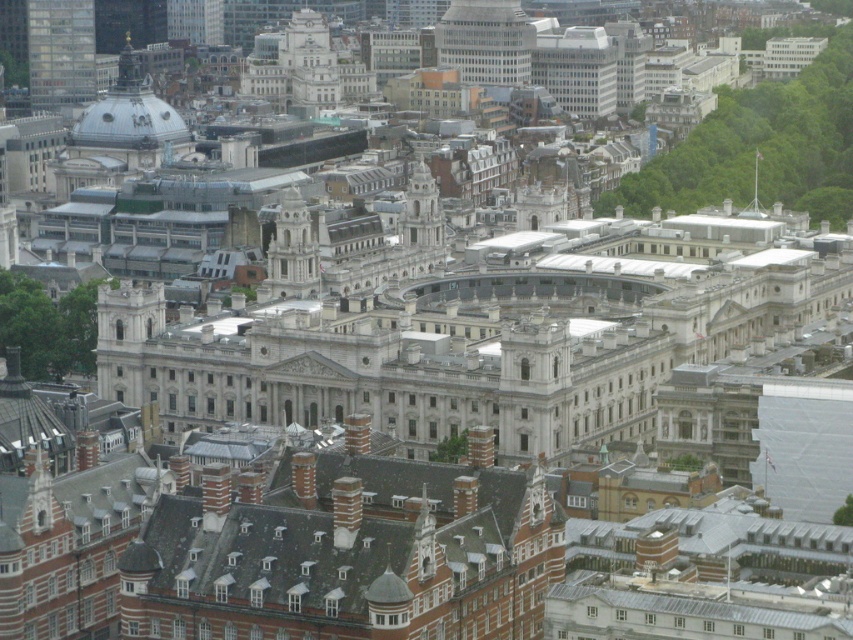
You are a city planner reviewing this aerial image. You need to determine the spatial relationship between the white glass tower at center and the white stone tower at center. Which one is located to the right of the other?

The white glass tower at center is positioned on the right side of the white stone tower at center.

You are a drone operator trying to deliver a package to the white glass tower at center. Your GPS shows a coordinate point at (485, 42). Is this the correct location for the white glass tower at center?

Yes, the point at (485, 42) corresponds to the white glass tower at center, so this is the correct location.

You are a city planner analyzing the urban layout. Given that the white glass tower at center and the white stone tower at center are both central landmarks, which one has a greater horizontal span when viewed from above?

The white glass tower at center has a greater horizontal span than the white stone tower at center, as its width is larger according to the description.